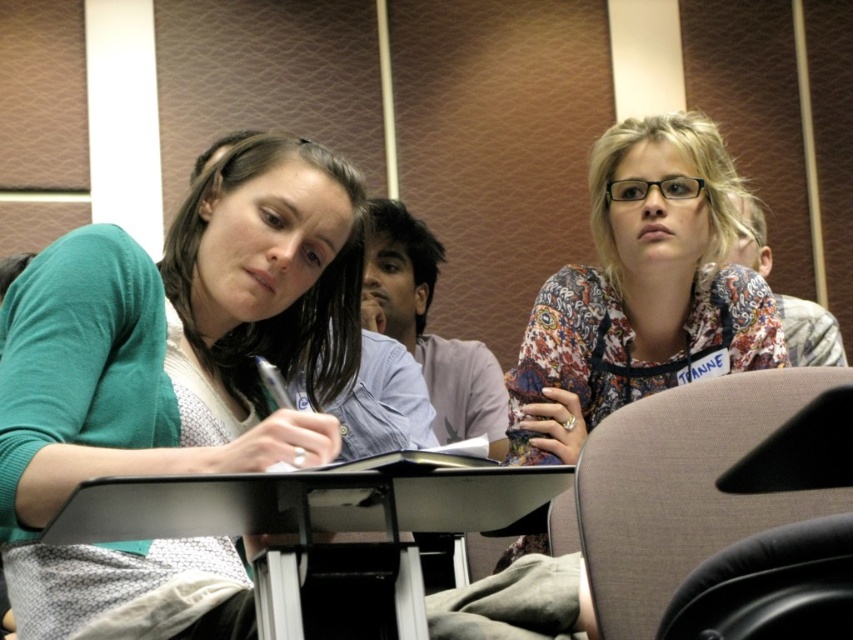
Measure the distance from green matte sweater at left to black leather chair at lower right.

A distance of 37.35 inches exists between green matte sweater at left and black leather chair at lower right.

Which is behind, point (18, 604) or point (778, 541)?

The point (18, 604) is behind.

The width and height of the screenshot is (853, 640). Identify the location of green matte sweater at left. (173, 381).

Where is `green matte sweater at left`? green matte sweater at left is located at coordinates (173, 381).

Who is lower down, green matte sweater at left or brown fabric chair at lower right?

brown fabric chair at lower right is lower down.

Identify the location of green matte sweater at left. (173, 381).

You are a GUI agent. You are given a task and a screenshot of the screen. Output one action in this format:
    pyautogui.click(x=<x>, y=<y>)
    Task: Click on the green matte sweater at left
    The image size is (853, 640).
    Given the screenshot: What is the action you would take?
    pyautogui.click(x=173, y=381)

Image resolution: width=853 pixels, height=640 pixels. What do you see at coordinates (163, 508) in the screenshot?
I see `black plastic table at center` at bounding box center [163, 508].

Who is more distant from viewer, (428, 516) or (752, 637)?

The point (428, 516) is behind.

Where is `black plastic table at center`? This screenshot has width=853, height=640. black plastic table at center is located at coordinates (163, 508).